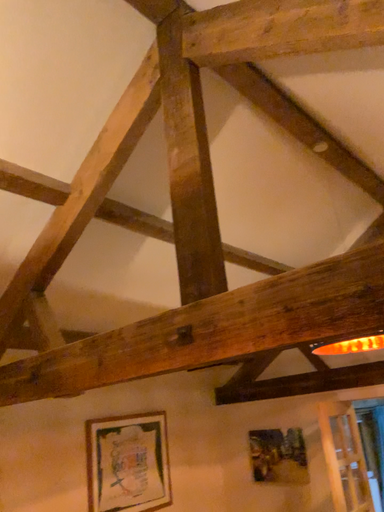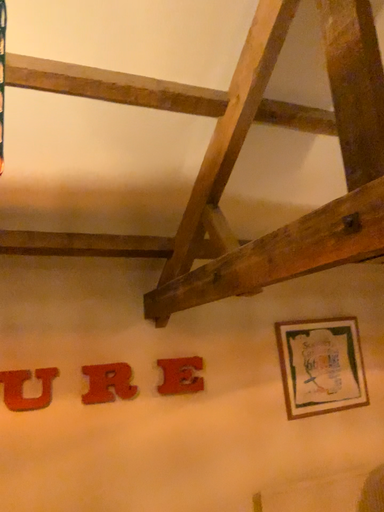
Question: How did the camera likely rotate when shooting the video?

Choices:
 (A) rotated downward
 (B) rotated upward

Answer: (A)